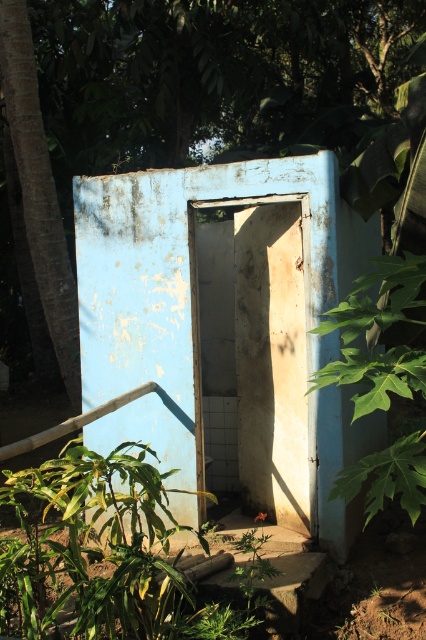
Question: Can you confirm if green leafy tree at center is positioned above green leafy plant at right?

Choices:
 (A) yes
 (B) no

Answer: (A)

Question: Does green leafy tree at center appear on the right side of green leafy plant at right?

Choices:
 (A) yes
 (B) no

Answer: (B)

Question: Is white matte door at center to the right of green leafy plant at right from the viewer's perspective?

Choices:
 (A) no
 (B) yes

Answer: (A)

Question: Which of the following is the closest to the observer?

Choices:
 (A) white matte door at center
 (B) blue painted concrete hut at center
 (C) green leafy tree at center

Answer: (B)

Question: Which of the following is the farthest from the observer?

Choices:
 (A) (94, 179)
 (B) (131, 52)

Answer: (B)

Question: Estimate the real-world distances between objects in this image. Which object is closer to the white matte door at center?

Choices:
 (A) brown rough tree trunk at left
 (B) green leafy plant at right

Answer: (B)